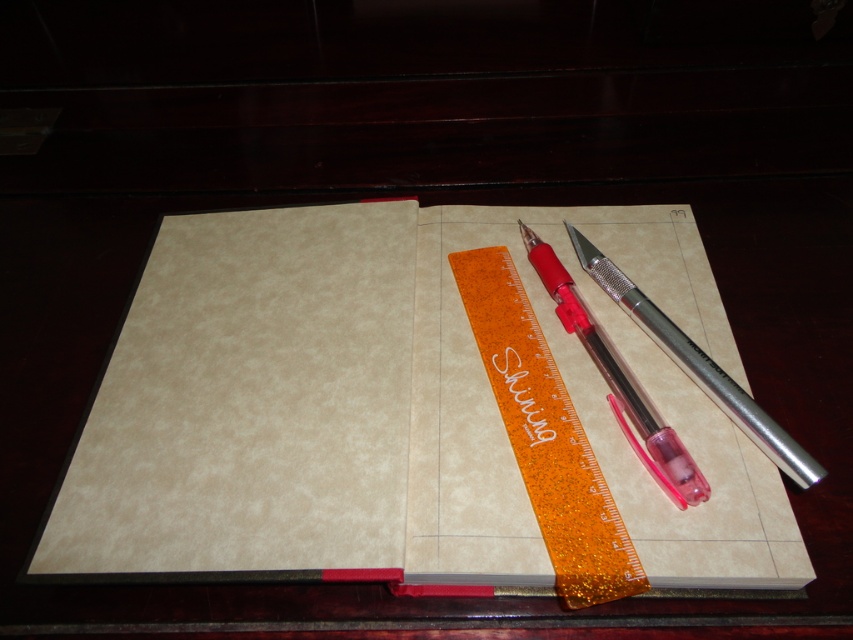
Which of these two, orange glitter ruler at center or metallic silver pen at center-right, stands taller?

orange glitter ruler at center is taller.

At what (x,y) coordinates should I click in order to perform the action: click on orange glitter ruler at center. Please return your answer as a coordinate pair (x, y). The width and height of the screenshot is (853, 640). Looking at the image, I should click on (546, 436).

You are a GUI agent. You are given a task and a screenshot of the screen. Output one action in this format:
    pyautogui.click(x=<x>, y=<y>)
    Task: Click on the orange glitter ruler at center
    This screenshot has height=640, width=853.
    Given the screenshot: What is the action you would take?
    pyautogui.click(x=546, y=436)

Which of these two, matte paper notebook at center or transparent plastic pencil at center, stands shorter?

transparent plastic pencil at center is shorter.

Is matte paper notebook at center further to the viewer compared to transparent plastic pencil at center?

No, it is in front of transparent plastic pencil at center.

This screenshot has height=640, width=853. Describe the element at coordinates (387, 408) in the screenshot. I see `matte paper notebook at center` at that location.

Image resolution: width=853 pixels, height=640 pixels. Find the location of `matte paper notebook at center`. matte paper notebook at center is located at coordinates (387, 408).

Who is shorter, transparent plastic pencil at center or metallic silver pen at center-right?

metallic silver pen at center-right is shorter.

Can you confirm if transparent plastic pencil at center is taller than metallic silver pen at center-right?

Yes.

Which is behind, point (688, 456) or point (722, 401)?

The point (722, 401) is behind.

This screenshot has width=853, height=640. I want to click on transparent plastic pencil at center, so pos(618,380).